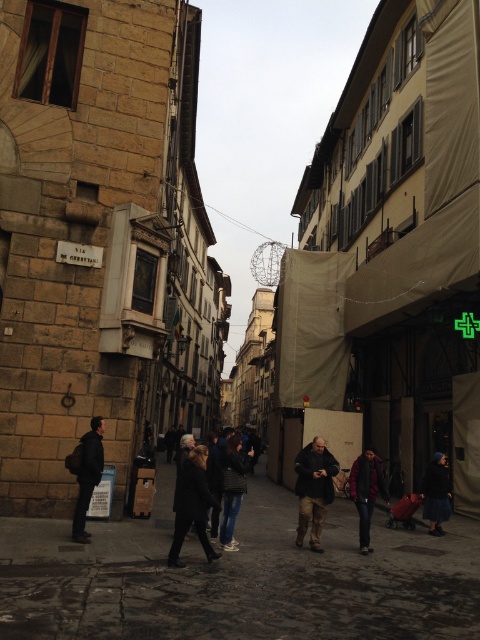
You are a tourist carrying a dark gray backpack at left and want to walk through the dark gray stone alley at center. Based on their widths, will you have enough space to pass through comfortably?

The dark gray stone alley at center is wider than the dark gray backpack at left, so you will have enough space to pass through comfortably.

You are a tourist in this European city and want to take a photo of both the dark red jacket at center and the dark blue fabric coat at lower right in the same frame. Based on their positions, can you fit both into your camera viewfinder without moving your position?

The dark red jacket at center is located above the dark blue fabric coat at lower right, so yes, you can fit both into your camera viewfinder by adjusting the framing to include the upper and lower areas where they are positioned.

Consider the image. You are a delivery person standing at the entrance of the street. You need to locate the dark gray backpack at left. According to the coordinates provided, where should you look?

The dark gray backpack at left is located at coordinates point (87, 476).